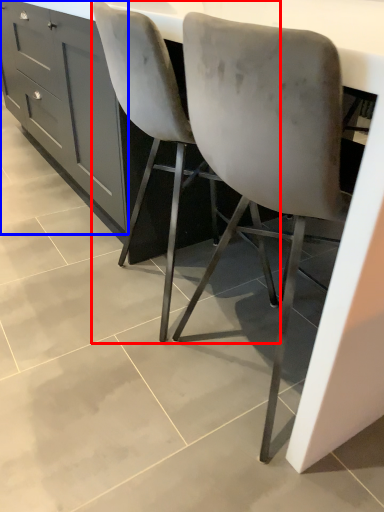
Question: Which object is closer to the camera taking this photo, chair (highlighted by a red box) or cabinetry (highlighted by a blue box)?

Choices:
 (A) chair
 (B) cabinetry

Answer: (A)